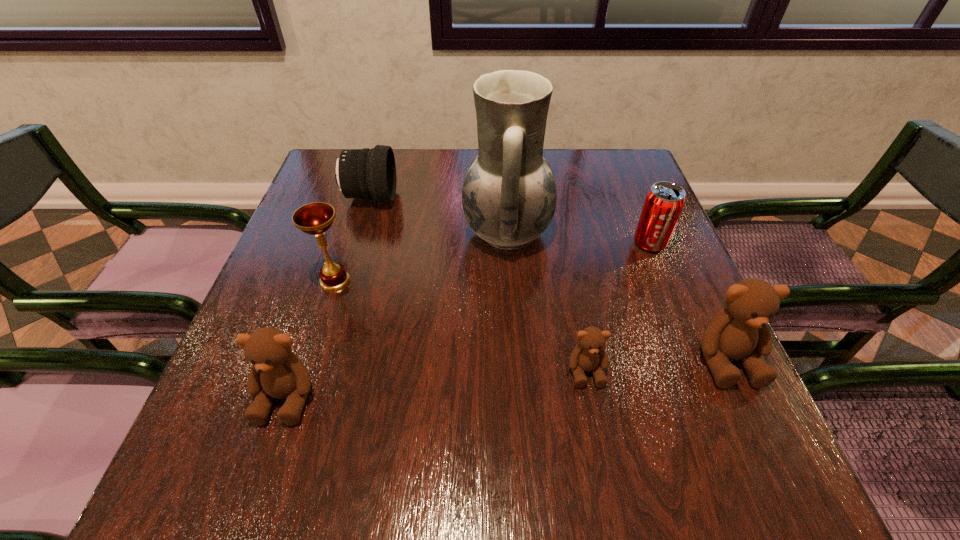
The height and width of the screenshot is (540, 960). What are the coordinates of `unoccupied area between the rightmost teddy bear and the shortest teddy bear` in the screenshot? It's located at (657, 365).

The image size is (960, 540). In order to click on free space between the second shortest teddy bear and the telephoto lens in this screenshot , I will do `click(328, 297)`.

I want to click on vacant region between the second teddy bear from left to right and the telephoto lens, so click(x=478, y=284).

I want to click on free spot between the tallest object and the shortest teddy bear, so click(546, 301).

Find the location of a particular element. This screenshot has height=540, width=960. free space between the chalice and the rightmost teddy bear is located at coordinates (531, 320).

This screenshot has width=960, height=540. Identify the location of empty location between the rightmost teddy bear and the leftmost teddy bear. (507, 377).

Identify the location of free space between the second teddy bear from right to left and the chalice. The image size is (960, 540). (461, 326).

Find the location of a particular element. The image size is (960, 540). free space between the second tallest teddy bear and the chalice is located at coordinates [311, 339].

Identify the location of free space between the chalice and the telephoto lens. (352, 239).

Where is `free space between the tallest object and the second tallest teddy bear`? This screenshot has width=960, height=540. free space between the tallest object and the second tallest teddy bear is located at coordinates (396, 314).